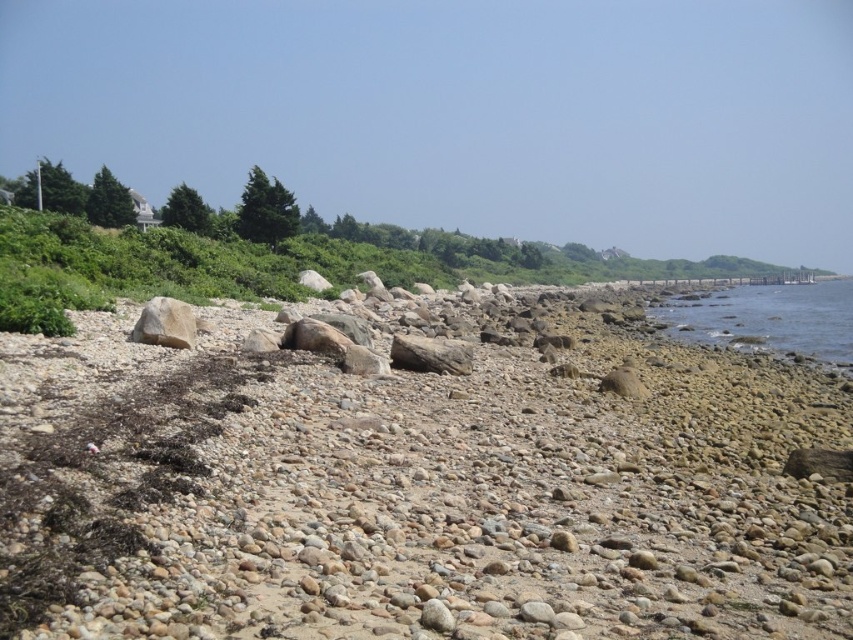
Does clear water at lower right have a lesser height compared to smooth beige rock at center-left?

No, clear water at lower right is not shorter than smooth beige rock at center-left.

Is clear water at lower right bigger than smooth beige rock at center-left?

Yes, clear water at lower right is bigger than smooth beige rock at center-left.

Is point (846, 298) more distant than point (136, 337)?

That is True.

Find the location of a particular element. The image size is (853, 640). clear water at lower right is located at coordinates (769, 317).

Is smooth pebbles at center to the left of smooth beige rock at center-left from the viewer's perspective?

Incorrect, smooth pebbles at center is not on the left side of smooth beige rock at center-left.

What do you see at coordinates (416, 490) in the screenshot?
I see `smooth pebbles at center` at bounding box center [416, 490].

Identify the location of smooth pebbles at center. (416, 490).

Does point (651, 440) come behind point (792, 301)?

No.

The width and height of the screenshot is (853, 640). In order to click on smooth pebbles at center in this screenshot , I will do `click(416, 490)`.

Where is `smooth pebbles at center`? Image resolution: width=853 pixels, height=640 pixels. smooth pebbles at center is located at coordinates (416, 490).